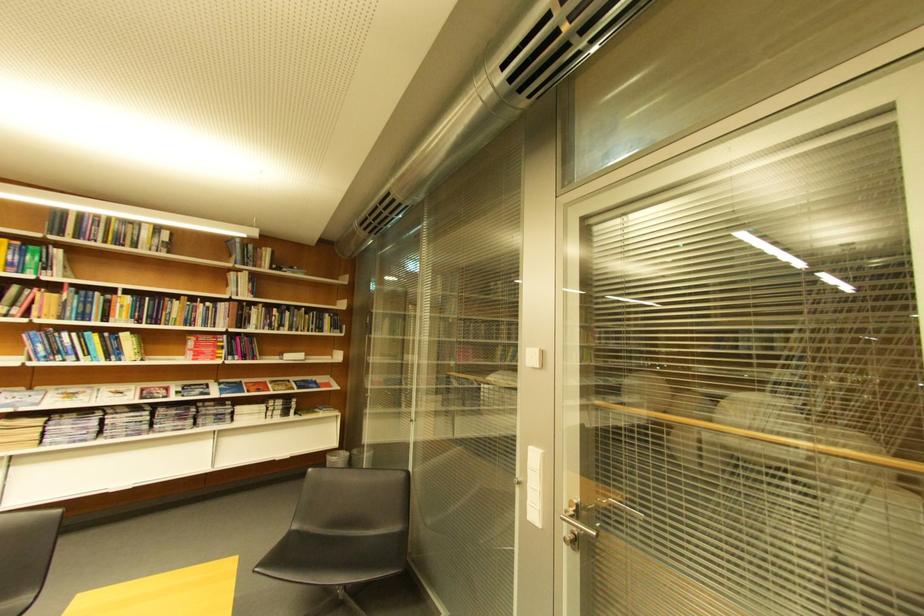
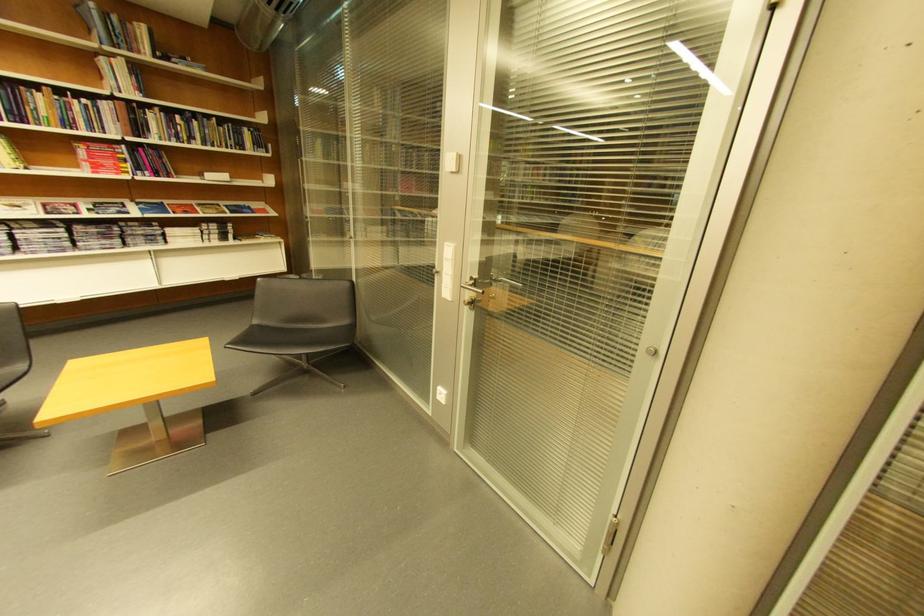
In the second image, find the point that corresponds to the point at 300,533 in the first image.

(262, 329)